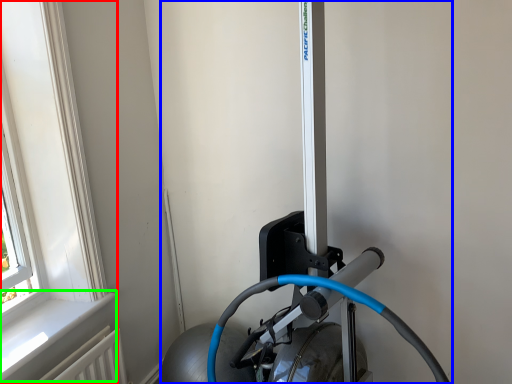
Question: Based on their relative distances, which object is nearer to window (highlighted by a red box)? Choose from sport equipment (highlighted by a blue box) and window sill (highlighted by a green box).

Choices:
 (A) sport equipment
 (B) window sill

Answer: (B)